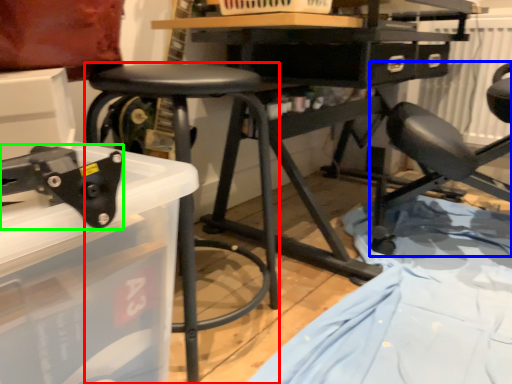
Question: Which object is positioned closest to stool (highlighted by a red box)? Select from chair (highlighted by a blue box) and tool (highlighted by a green box).

Choices:
 (A) chair
 (B) tool

Answer: (B)